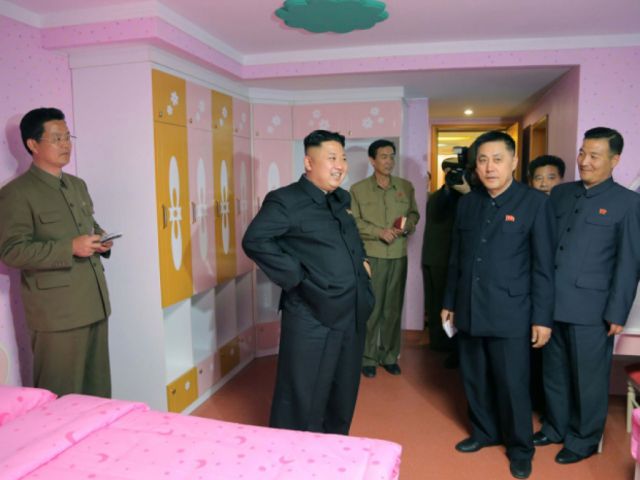
The height and width of the screenshot is (480, 640). Identify the location of pink wall. (40, 60), (612, 68).